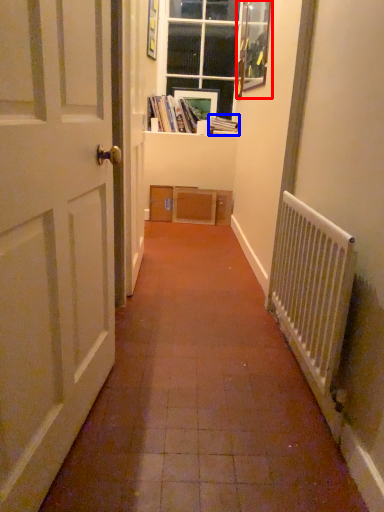
Question: Which object appears farthest to the camera in this image, picture frame (highlighted by a red box) or book (highlighted by a blue box)?

Choices:
 (A) picture frame
 (B) book

Answer: (B)